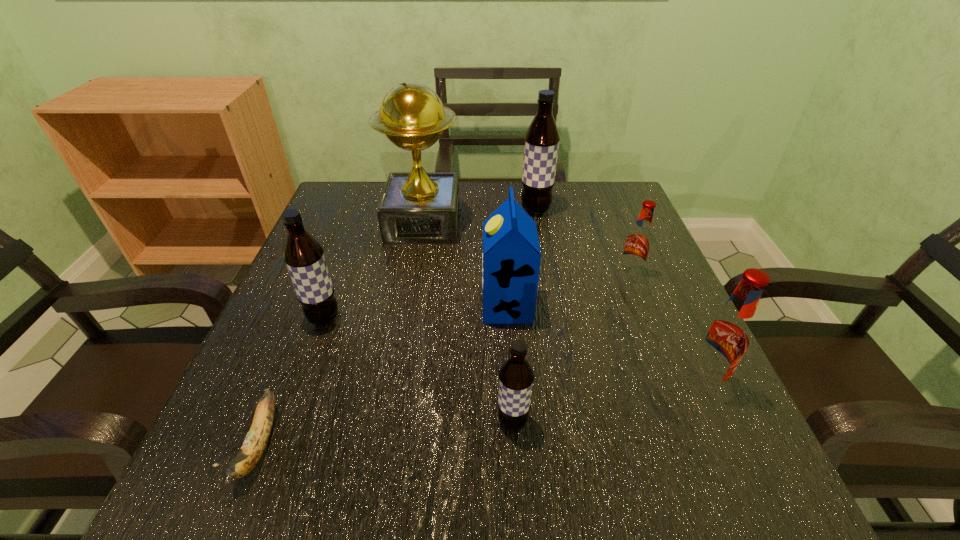
Find the location of a particular element. Image resolution: width=960 pixels, height=540 pixels. free region that satisfies the following two spatial constraints: 1. on the front-facing side of the second root beer from left to right; 2. on the left side of the award is located at coordinates (389, 421).